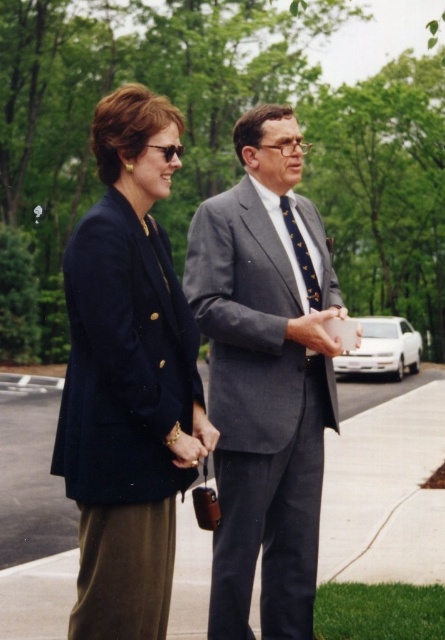
Does navy blue blazer at left come behind gray concrete pavement at center?

No.

Which of these two, navy blue blazer at left or gray concrete pavement at center, stands taller?

navy blue blazer at left is taller.

Does point (145, 339) come closer to viewer compared to point (404, 429)?

Yes, point (145, 339) is closer to viewer.

Identify the location of navy blue blazer at left. This screenshot has width=445, height=640. (128, 378).

This screenshot has height=640, width=445. What do you see at coordinates (128, 378) in the screenshot?
I see `navy blue blazer at left` at bounding box center [128, 378].

Which of these two, navy blue blazer at left or gray suit at center, stands shorter?

With less height is navy blue blazer at left.

Describe the element at coordinates (128, 378) in the screenshot. I see `navy blue blazer at left` at that location.

Locate an element on the screen. The height and width of the screenshot is (640, 445). navy blue blazer at left is located at coordinates (128, 378).

Can you confirm if gray suit at center is wider than gray concrete pavement at center?

No.

Does gray suit at center have a larger size compared to gray concrete pavement at center?

Actually, gray suit at center might be smaller than gray concrete pavement at center.

Where is `gray suit at center`? gray suit at center is located at coordinates (266, 376).